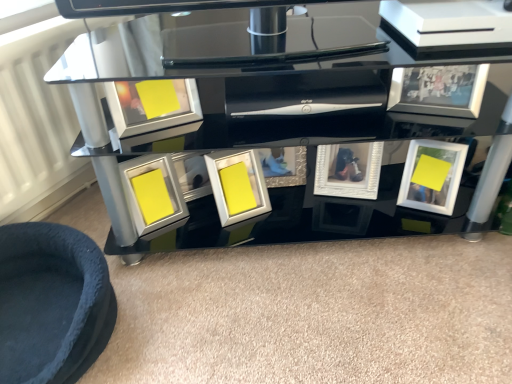
The image size is (512, 384). What are the coordinates of `free space in front of white textured frame at center, acting as the 3th picture frame starting from the right` in the screenshot? It's located at (359, 215).